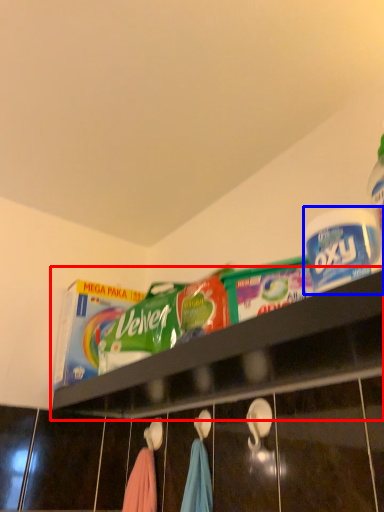
Question: Which object is further to the camera taking this photo, shelf (highlighted by a red box) or product (highlighted by a blue box)?

Choices:
 (A) shelf
 (B) product

Answer: (B)